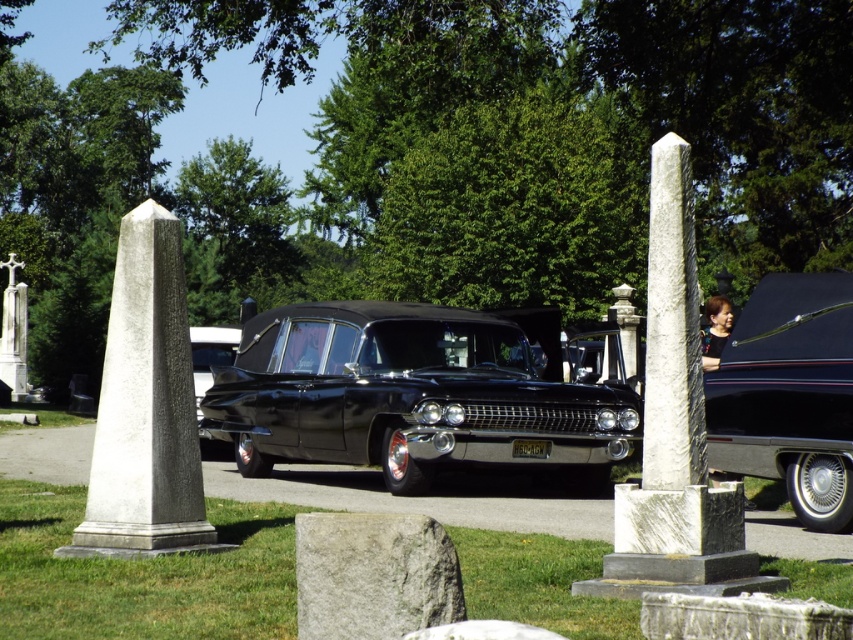
Is point (650, 451) less distant than point (15, 332)?

Yes.

Which is more to the left, white marble obelisk at center or white marble cross at center?

Positioned to the left is white marble cross at center.

Measure the distance between point (670,353) and camera.

Point (670,353) and camera are 6.77 meters apart.

Find the location of a particular element. white marble obelisk at center is located at coordinates (672, 328).

Which is behind, point (589, 397) or point (16, 337)?

The point (16, 337) is more distant.

Who is more forward, (x=393, y=484) or (x=3, y=326)?

Answer: Positioned in front is point (x=393, y=484).

Find the location of a particular element. The image size is (853, 640). glossy black hearse at center is located at coordinates (412, 396).

Does glossy black hearse at center appear over gray marble obelisk at center?

Incorrect, glossy black hearse at center is not positioned above gray marble obelisk at center.

Is point (474, 451) closer to camera compared to point (143, 502)?

That is False.

You are a GUI agent. You are given a task and a screenshot of the screen. Output one action in this format:
    pyautogui.click(x=<x>, y=<y>)
    Task: Click on the glossy black hearse at center
    The height and width of the screenshot is (640, 853).
    Given the screenshot: What is the action you would take?
    pyautogui.click(x=412, y=396)

Find the location of a particular element. glossy black hearse at center is located at coordinates (412, 396).